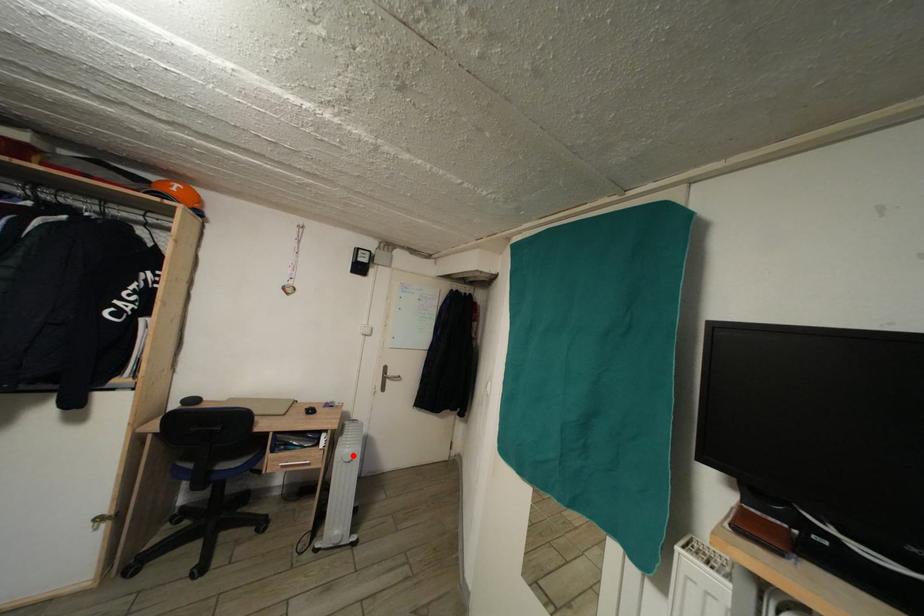
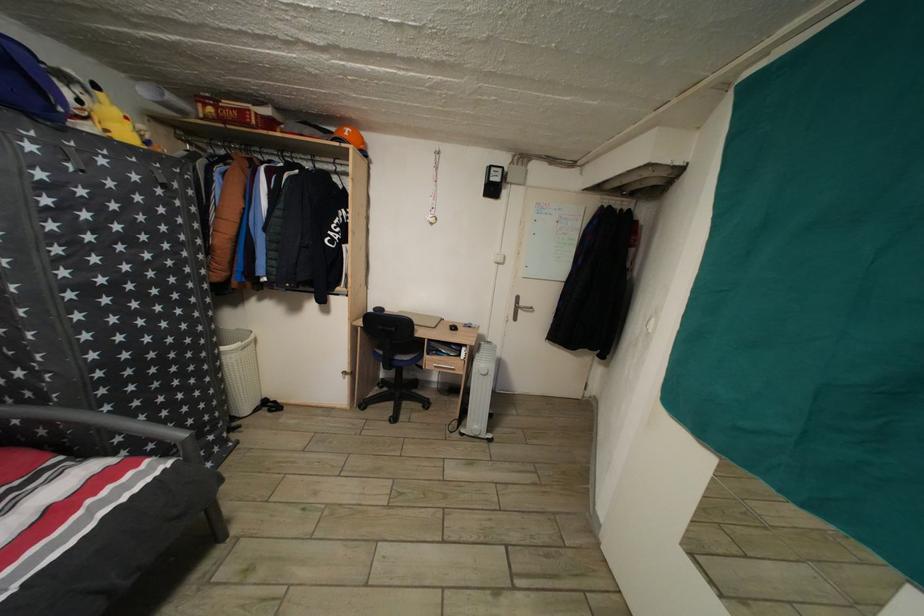
Find the pixel in the second image that matches the highlighted location in the first image.

(489, 371)